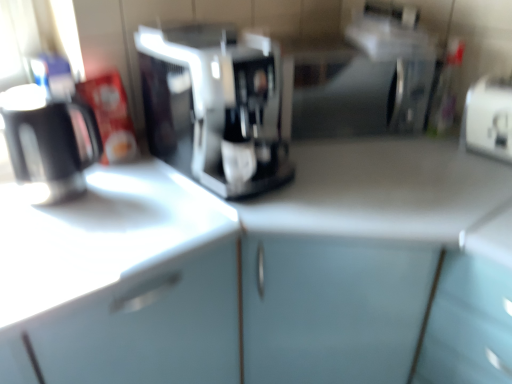
Where is `vacant area that is in front of white plastic toaster at right`? vacant area that is in front of white plastic toaster at right is located at coordinates (487, 173).